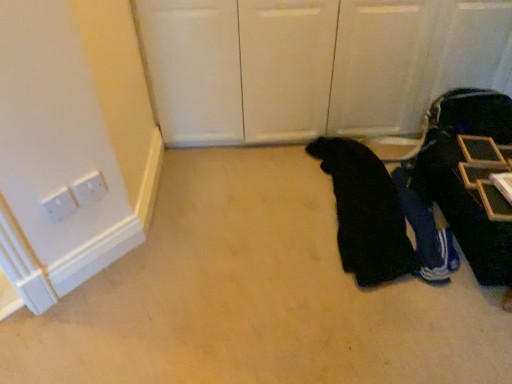
Question: Are black fabric at lower right, acting as the first person starting from the left, and dark blue fabric suitcase at right located far from each other?

Choices:
 (A) no
 (B) yes

Answer: (A)

Question: Is black fabric at lower right, positioned as the second person in right-to-left order, oriented away from dark blue fabric suitcase at right?

Choices:
 (A) no
 (B) yes

Answer: (A)

Question: Can you confirm if black fabric at lower right, positioned as the second person in right-to-left order, is positioned to the left of dark blue fabric suitcase at right?

Choices:
 (A) no
 (B) yes

Answer: (B)

Question: Can you confirm if black fabric at lower right, positioned as the second person in right-to-left order, is thinner than dark blue fabric suitcase at right?

Choices:
 (A) yes
 (B) no

Answer: (B)

Question: Does black fabric at lower right, positioned as the second person in right-to-left order, have a smaller size compared to dark blue fabric suitcase at right?

Choices:
 (A) yes
 (B) no

Answer: (A)

Question: Is black fabric at lower right, positioned as the second person in right-to-left order, not inside dark blue fabric suitcase at right?

Choices:
 (A) yes
 (B) no

Answer: (A)

Question: Is dark blue fabric suitcase at right smaller than blue fabric pants at lower right, acting as the first person starting from the right?

Choices:
 (A) no
 (B) yes

Answer: (A)

Question: Is dark blue fabric suitcase at right located outside blue fabric pants at lower right, marked as the 2th person in a left-to-right arrangement?

Choices:
 (A) yes
 (B) no

Answer: (A)

Question: From a real-world perspective, is dark blue fabric suitcase at right over blue fabric pants at lower right, acting as the first person starting from the right?

Choices:
 (A) no
 (B) yes

Answer: (B)

Question: Is dark blue fabric suitcase at right taller than blue fabric pants at lower right, marked as the 2th person in a left-to-right arrangement?

Choices:
 (A) no
 (B) yes

Answer: (B)

Question: Does dark blue fabric suitcase at right have a larger size compared to blue fabric pants at lower right, marked as the 2th person in a left-to-right arrangement?

Choices:
 (A) yes
 (B) no

Answer: (A)

Question: Considering the relative sizes of dark blue fabric suitcase at right and blue fabric pants at lower right, acting as the first person starting from the right, in the image provided, is dark blue fabric suitcase at right thinner than blue fabric pants at lower right, acting as the first person starting from the right,?

Choices:
 (A) yes
 (B) no

Answer: (A)

Question: From a real-world perspective, does blue fabric pants at lower right, acting as the first person starting from the right, sit lower than dark blue fabric suitcase at right?

Choices:
 (A) yes
 (B) no

Answer: (A)